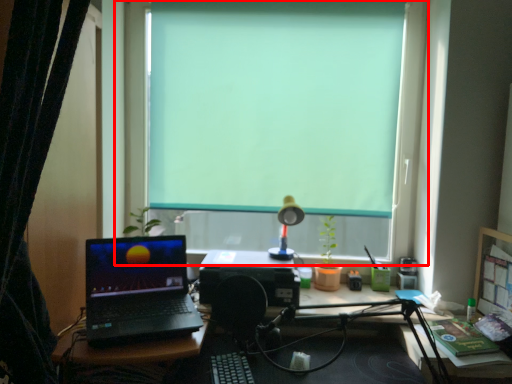
Question: From the image's perspective, where is window (annotated by the red box) located in relation to curtain in the image?

Choices:
 (A) above
 (B) below

Answer: (A)